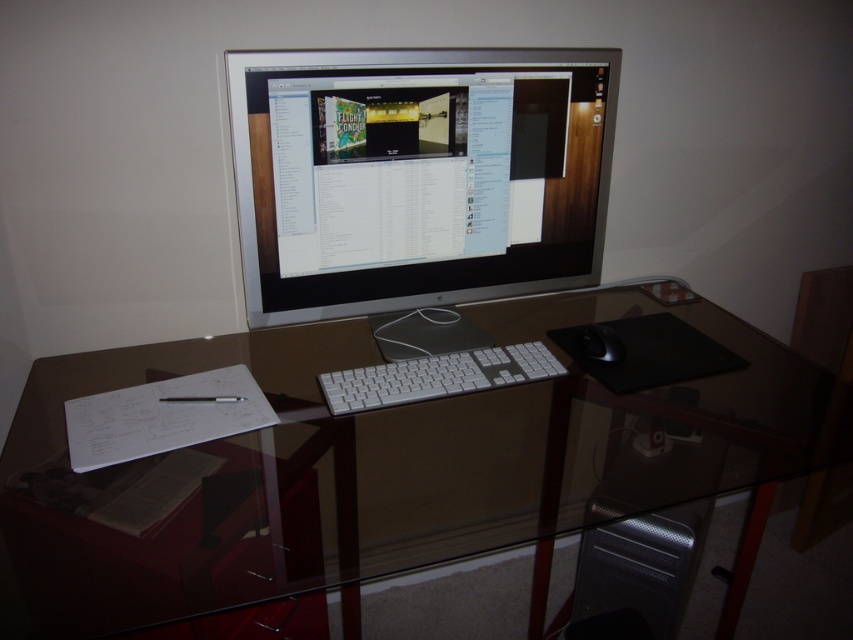
You are setting up a new monitor and want to ensure it fits on your desk. The current monitor is the satin silver monitor at center, and there is a black matte mouse at right. Which object is taller?

The satin silver monitor at center is taller than the black matte mouse at right according to the description.

Based on the photo, you are organizing your workspace and want to place a 30 cm wide laptop between the transparent glass table at center and the black matte mouse at right. Can the laptop fit in the space between them?

The distance between the transparent glass table at center and the black matte mouse at right is 35.16 centimeters. Since the laptop is 30 cm wide, it can fit in the space between them as there is enough room.

You are organizing your desk and want to place a new item between the transparent glass table at center and the black matte mouse at right. Is there enough space to place it there?

The transparent glass table at center is to the left of the black matte mouse at right, so there is space between them to place a new item.